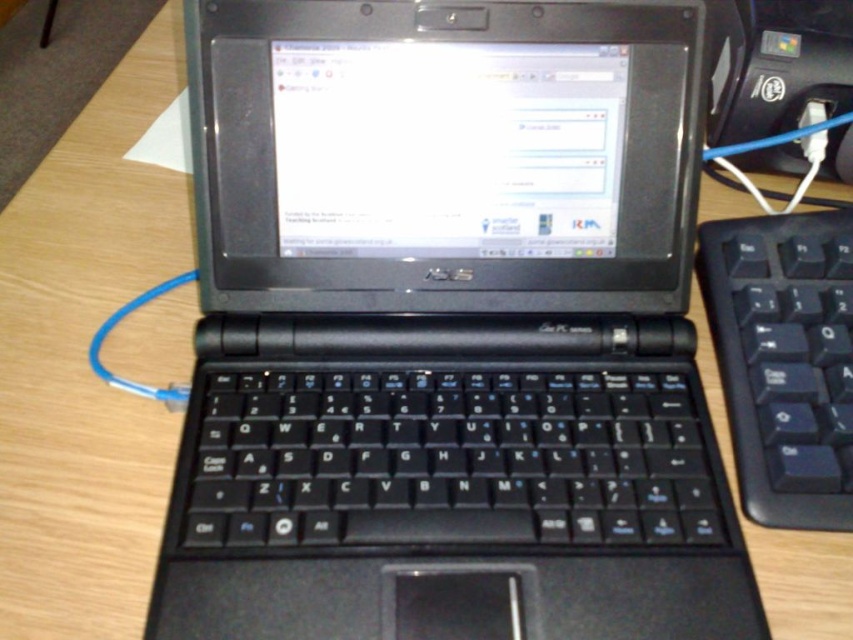
You are a delivery person who needs to place a small package on the desk without touching the black plastic laptop at center. The package is 12 inches long. Can you fit it horizontally on the desk next to the laptop?

The black plastic laptop at center and viewer are 14.65 inches apart. Since the package is 12 inches long, which is shorter than the distance between the laptop and the viewer, you can fit it horizontally on the desk next to the laptop without touching it.

You are setting up a workspace and need to place a black plastic laptop at center and a black plastic keyboard at right on a desk. If the desk has limited space, which object should you prioritize placing first to ensure both fit comfortably?

The black plastic keyboard at right should be placed first since the black plastic laptop at center is wider. By placing the wider laptop first, you can ensure there is enough space left for the narrower keyboard on the right side.

Based on the scene description, what are the coordinates of the black plastic laptop at center?

The coordinates of the black plastic laptop at center are at point (445, 368).